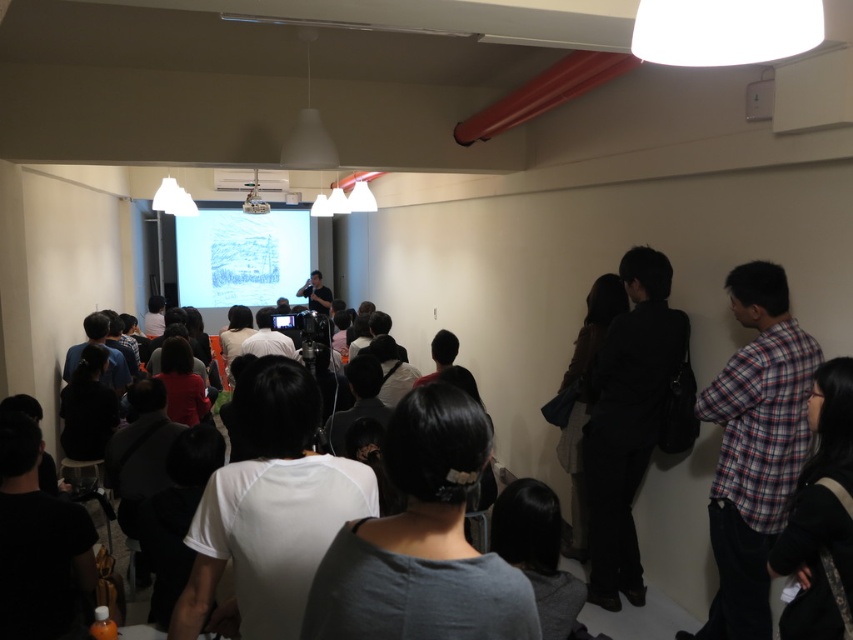
You are standing in the room and see a point marked at coordinates (753, 448). What object is located at that point?

The point at coordinates (753, 448) corresponds to the plaid fabric shirt at right.

You are standing in the room and want to move to the point at coordinates (x=740, y=362). If you are 1.70 meters tall, will your head hit the ceiling when you reach there?

The point at coordinates (x=740, y=362) is 2.40 meters away from you. Since the distance to the point is not related to the height of the ceiling, your head will not hit the ceiling when you reach there.

Based on the photo, you are an attendee at the presentation and you need to borrow a pen from the person wearing the plaid fabric shirt at right. However, there is a black fabric bag at right blocking your path. Can you walk around the bag to reach the person?

The plaid fabric shirt at right is to the right of the black fabric bag at right, so you can walk around the bag to the right side to reach the person wearing the plaid fabric shirt at right.